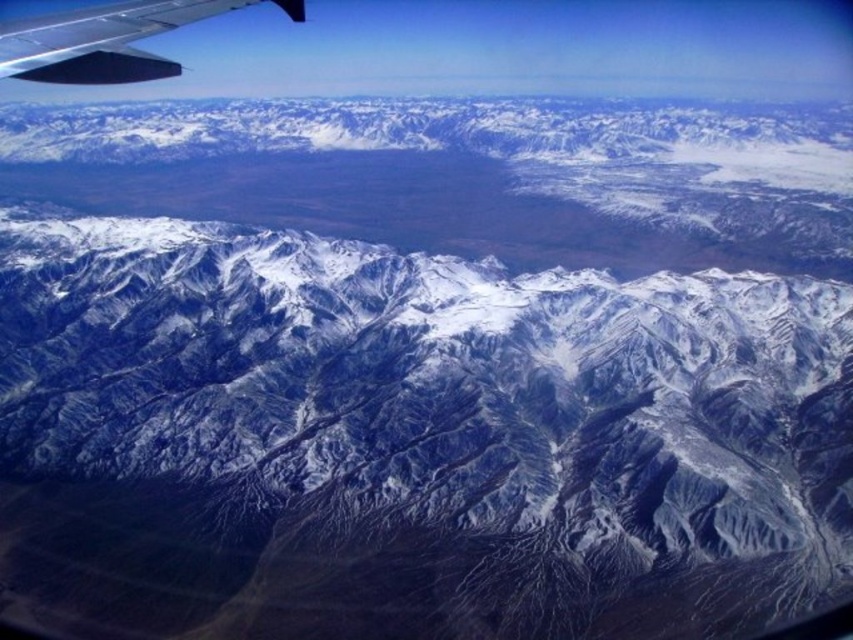
Question: Among these points, which one is nearest to the camera?

Choices:
 (A) (106, 42)
 (B) (223, 157)

Answer: (A)

Question: Can you confirm if snowy rocky mountain range at center is positioned to the left of matte black wing at upper left?

Choices:
 (A) no
 (B) yes

Answer: (A)

Question: Considering the relative positions of snowy rocky mountain range at center and matte black wing at upper left in the image provided, where is snowy rocky mountain range at center located with respect to matte black wing at upper left?

Choices:
 (A) below
 (B) above

Answer: (B)

Question: Among these points, which one is nearest to the camera?

Choices:
 (A) (33, 22)
 (B) (339, 170)

Answer: (A)

Question: Is snowy rocky mountain range at center below matte black wing at upper left?

Choices:
 (A) no
 (B) yes

Answer: (A)

Question: Which object appears closest to the camera in this image?

Choices:
 (A) snowy rocky mountain range at center
 (B) matte black wing at upper left

Answer: (B)